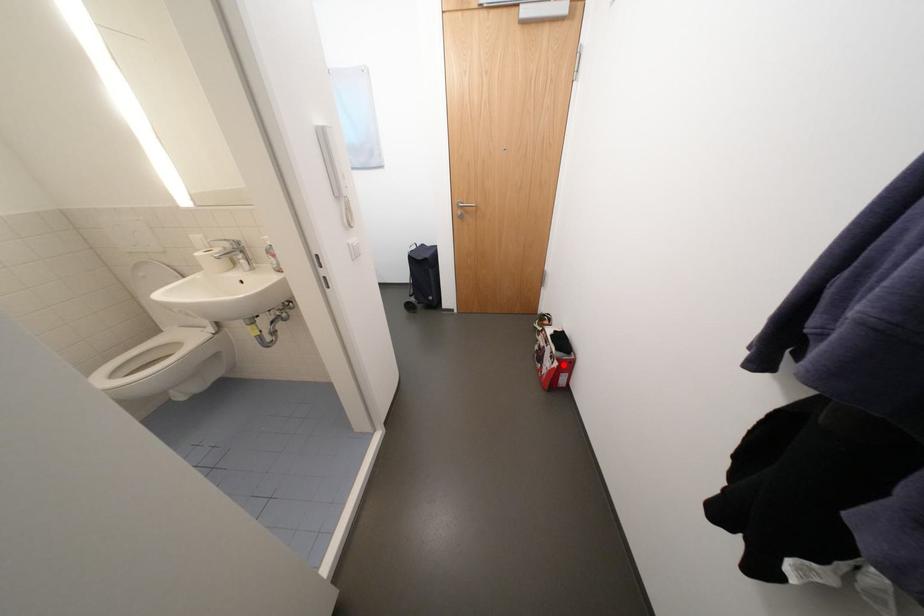
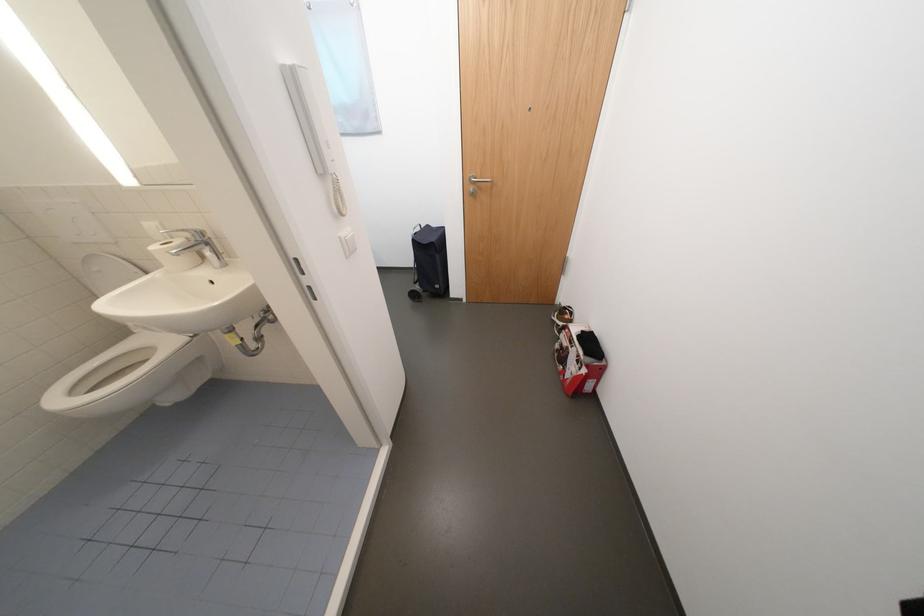
Locate, in the second image, the point that corresponds to the highlighted location in the first image.

(592, 371)